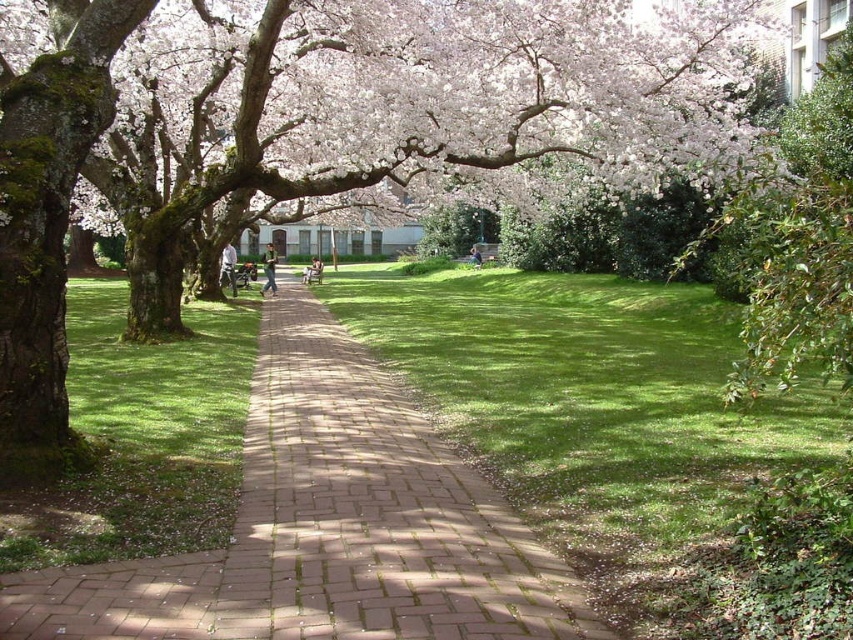
Is green mossy tree at center thinner than white blossoms at upper center?

Indeed, green mossy tree at center has a lesser width compared to white blossoms at upper center.

Can you confirm if green mossy tree at center is positioned below white blossoms at upper center?

Yes.

This screenshot has height=640, width=853. I want to click on green mossy tree at center, so click(302, 125).

The width and height of the screenshot is (853, 640). I want to click on green mossy tree at center, so click(x=302, y=125).

Which is below, green mossy tree at center or green grass at center?

Positioned lower is green grass at center.

Does green mossy tree at center have a smaller size compared to green grass at center?

No, green mossy tree at center is not smaller than green grass at center.

Where is `green mossy tree at center`? The image size is (853, 640). green mossy tree at center is located at coordinates 302,125.

I want to click on green mossy tree at center, so click(x=302, y=125).

Is green grass at center positioned at the back of brick pavement at center?

No, it is not.

Who is higher up, green grass at center or brick pavement at center?

green grass at center is above.

At what (x,y) coordinates should I click in order to perform the action: click on green grass at center. Please return your answer as a coordinate pair (x, y). This screenshot has height=640, width=853. Looking at the image, I should click on (596, 419).